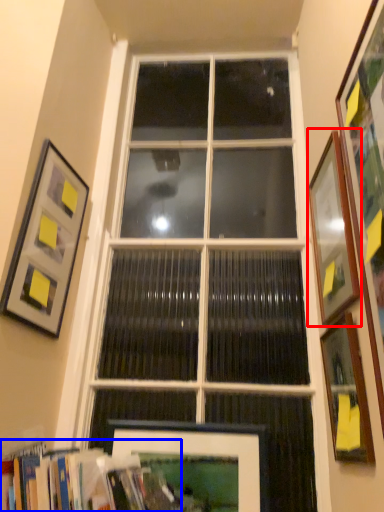
Question: Which of the following is the closest to the observer, picture frame (highlighted by a red box) or bookcase (highlighted by a blue box)?

Choices:
 (A) picture frame
 (B) bookcase

Answer: (B)